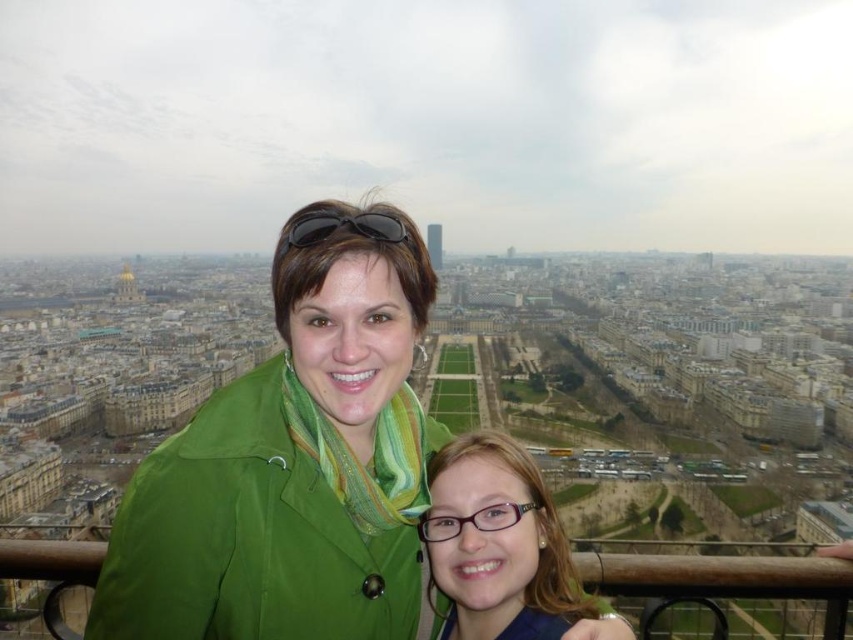
Which is more to the right, green fabric jacket at center or matte green jacket at center?

Positioned to the right is matte green jacket at center.

Where is `green fabric jacket at center`? This screenshot has width=853, height=640. green fabric jacket at center is located at coordinates (291, 468).

Can you confirm if green fabric jacket at center is wider than black matte sunglasses at center?

Yes, green fabric jacket at center is wider than black matte sunglasses at center.

Who is positioned more to the left, green fabric jacket at center or black matte sunglasses at center?

green fabric jacket at center

Is point (213, 460) closer to camera compared to point (384, 214)?

Yes, it is in front of point (384, 214).

Locate an element on the screen. This screenshot has width=853, height=640. green fabric jacket at center is located at coordinates (291, 468).

Does matte green jacket at center appear on the right side of black matte sunglasses at center?

Indeed, matte green jacket at center is positioned on the right side of black matte sunglasses at center.

Is matte green jacket at center positioned in front of black matte sunglasses at center?

That is True.

Who is more distant from viewer, (451, 582) or (370, 216)?

Point (370, 216)

At what (x,y) coordinates should I click in order to perform the action: click on matte green jacket at center. Please return your answer as a coordinate pair (x, y). Looking at the image, I should click on (500, 545).